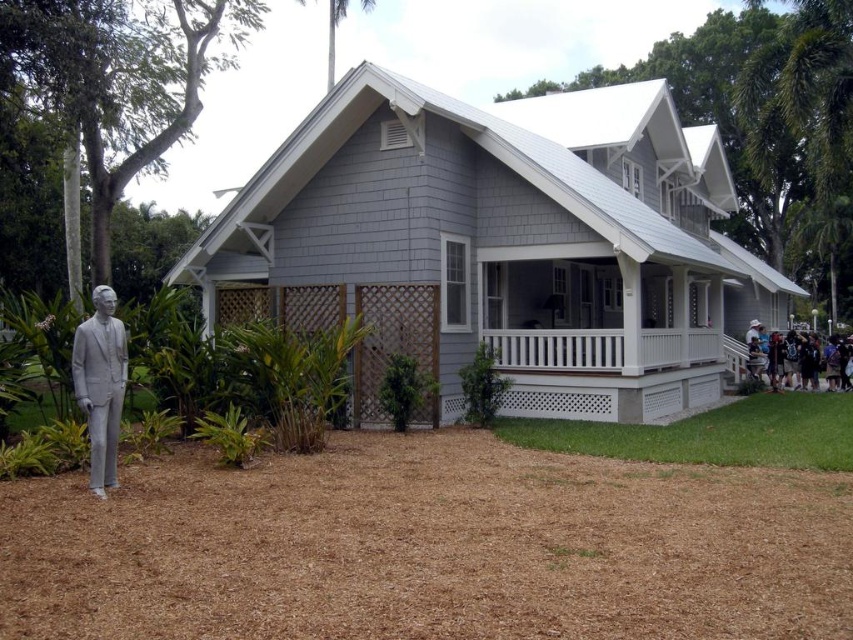
Question: Which of the following is the farthest from the observer?

Choices:
 (A) (107, 292)
 (B) (552, 342)

Answer: (B)

Question: Which of the following is the farthest from the observer?

Choices:
 (A) white matte statue at lower left
 (B) white painted wood porch at center
 (C) white cotton shirt at lower right

Answer: (C)

Question: Does white painted wood porch at center lie in front of white matte statue at lower left?

Choices:
 (A) yes
 (B) no

Answer: (B)

Question: Is white painted wood porch at center positioned before white cotton shirt at lower right?

Choices:
 (A) no
 (B) yes

Answer: (B)

Question: Which of the following is the farthest from the observer?

Choices:
 (A) (631, 369)
 (B) (91, 304)

Answer: (A)

Question: Can you confirm if white matte statue at lower left is positioned to the left of white cotton shirt at lower right?

Choices:
 (A) no
 (B) yes

Answer: (B)